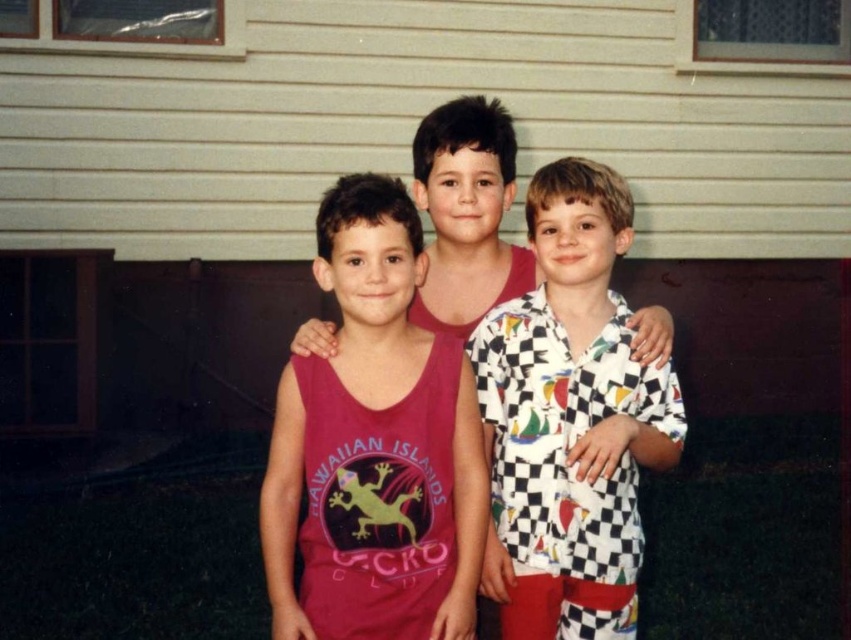
Who is positioned more to the left, matte pink tank top at center or white checkered shirt at center?

From the viewer's perspective, matte pink tank top at center appears more on the left side.

What do you see at coordinates (374, 445) in the screenshot?
I see `matte pink tank top at center` at bounding box center [374, 445].

Locate an element on the screen. This screenshot has height=640, width=851. matte pink tank top at center is located at coordinates (374, 445).